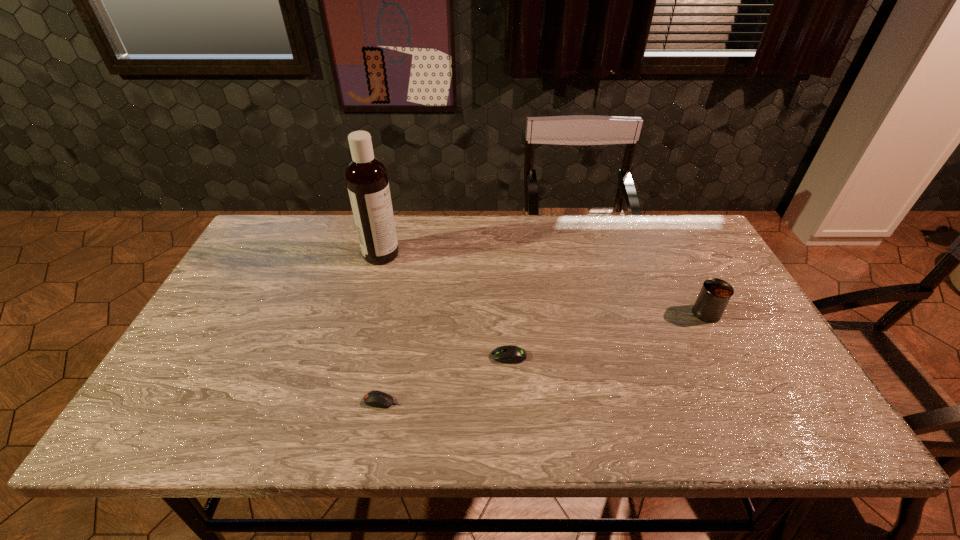
Identify the location of free space at the far left corner of the desktop. The width and height of the screenshot is (960, 540). (274, 219).

What are the coordinates of `vacant space at the far right corner of the desktop` in the screenshot? It's located at (678, 238).

Locate an element on the screen. The image size is (960, 540). free space at the near right corner is located at coordinates (780, 439).

Find the location of `vacant space that's between the can and the right computer mouse`. vacant space that's between the can and the right computer mouse is located at coordinates (608, 335).

This screenshot has width=960, height=540. Identify the location of unoccupied area between the tallest object and the nearest object. (382, 328).

The height and width of the screenshot is (540, 960). I want to click on free space between the tallest object and the nearest object, so click(382, 328).

The width and height of the screenshot is (960, 540). What are the coordinates of `vacant space that's between the left computer mouse and the can` in the screenshot? It's located at coord(544,357).

The height and width of the screenshot is (540, 960). I want to click on free area in between the nearer computer mouse and the tallest object, so click(x=382, y=328).

At what (x,y) coordinates should I click in order to perform the action: click on blank region between the can and the second nearest object. Please return your answer as a coordinate pair (x, y). Looking at the image, I should click on (608, 335).

The image size is (960, 540). In order to click on free spot between the can and the right computer mouse in this screenshot , I will do `click(608, 335)`.